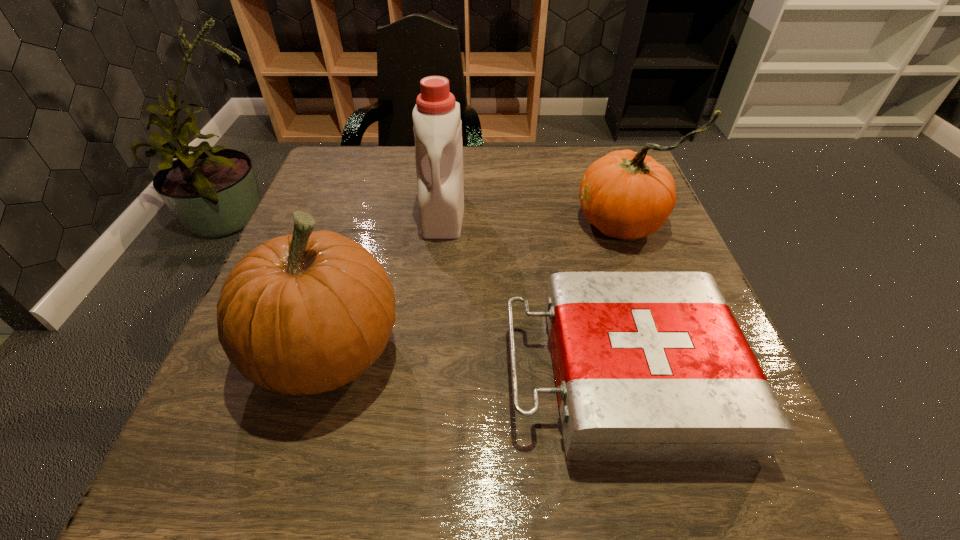
The width and height of the screenshot is (960, 540). I want to click on free spot at the left edge of the desktop, so click(x=349, y=233).

Where is `vacant position at the far left corner of the desktop`? This screenshot has width=960, height=540. vacant position at the far left corner of the desktop is located at coordinates (370, 171).

Find the location of a particular element. Image resolution: width=960 pixels, height=540 pixels. vacant area that lies between the detergent and the shortest object is located at coordinates (531, 294).

Locate an element on the screen. vacant area between the first-aid kit and the nearer pumpkin is located at coordinates (473, 363).

This screenshot has height=540, width=960. I want to click on empty space that is in between the shortest object and the detergent, so click(531, 294).

This screenshot has width=960, height=540. Find the location of `free space between the shortest object and the left pumpkin`. free space between the shortest object and the left pumpkin is located at coordinates (473, 363).

Where is `free area in between the shortest object and the left pumpkin`? This screenshot has width=960, height=540. free area in between the shortest object and the left pumpkin is located at coordinates (473, 363).

Where is `vacant area that lies between the shortest object and the nearer pumpkin`? The width and height of the screenshot is (960, 540). vacant area that lies between the shortest object and the nearer pumpkin is located at coordinates (473, 363).

Find the location of `vacant region between the detergent and the right pumpkin`. vacant region between the detergent and the right pumpkin is located at coordinates (532, 218).

What are the coordinates of `free area in between the left pumpkin and the right pumpkin` in the screenshot? It's located at (474, 287).